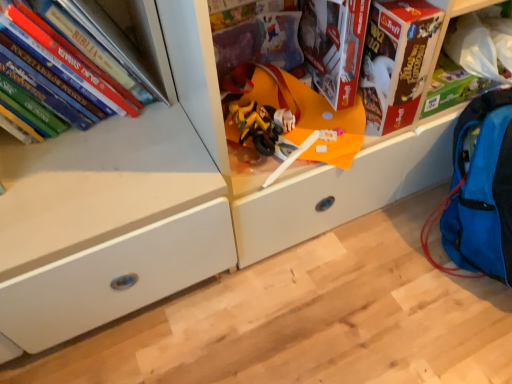
Question: Based on their positions, is yellow matte motorcycle at center located to the left or right of blue fabric backpack at lower right?

Choices:
 (A) left
 (B) right

Answer: (A)

Question: Is point (285, 102) positioned closer to the camera than point (458, 249)?

Choices:
 (A) farther
 (B) closer

Answer: (B)

Question: Which is nearer to the white matte drawer at center, marked as the 1th shelf in a front-to-back arrangement?

Choices:
 (A) hardcover books at left
 (B) cardboard box at upper right, the 2th shelf positioned from the front
 (C) yellow matte motorcycle at center
 (D) blue fabric backpack at lower right
 (E) red cardboard box at upper right

Answer: (E)

Question: Which of these objects is positioned farthest from the white matte drawer at center, which is the second shelf in back-to-front order?

Choices:
 (A) blue fabric backpack at lower right
 (B) red cardboard box at upper right
 (C) hardcover books at left
 (D) yellow matte motorcycle at center
 (E) cardboard box at upper right, which is the 1th shelf from back to front

Answer: (C)